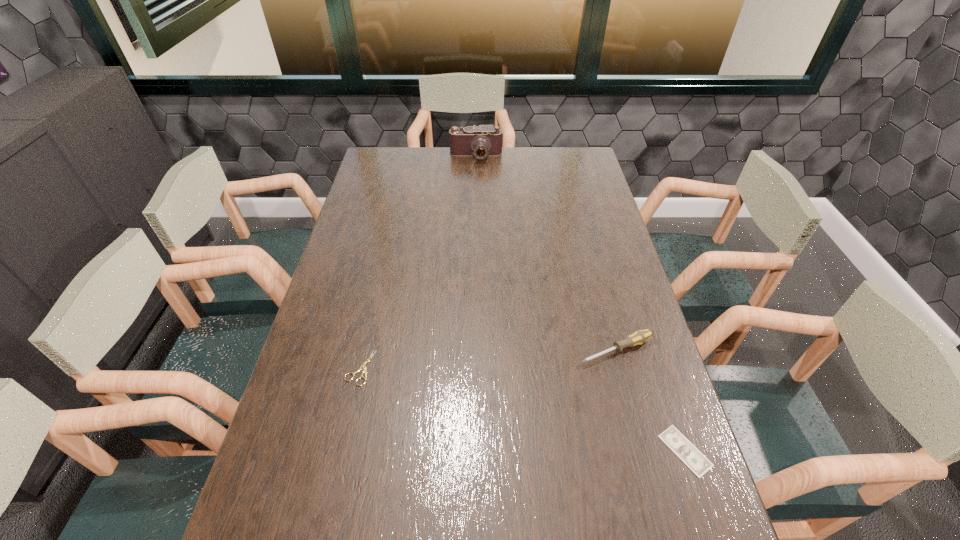
The image size is (960, 540). Identify the location of shears. (364, 370).

Where is `the second shortest object`? This screenshot has width=960, height=540. the second shortest object is located at coordinates pyautogui.click(x=364, y=370).

Where is `money`? This screenshot has width=960, height=540. money is located at coordinates (677, 442).

Identify the location of the shortest object. The height and width of the screenshot is (540, 960). (677, 442).

Image resolution: width=960 pixels, height=540 pixels. I want to click on camera, so click(x=481, y=141).

Image resolution: width=960 pixels, height=540 pixels. Find the location of `the tallest object`. the tallest object is located at coordinates (481, 141).

Find the location of a particular element. screwdriver is located at coordinates (639, 337).

This screenshot has height=540, width=960. Identify the location of free space located 0.230m on the right of the leftmost object. (462, 368).

The image size is (960, 540). Find the location of `free point located 0.060m on the front of the nearest object`. free point located 0.060m on the front of the nearest object is located at coordinates (705, 509).

This screenshot has height=540, width=960. I want to click on vacant position located on the front-facing side of the second object from left to right, so click(x=475, y=198).